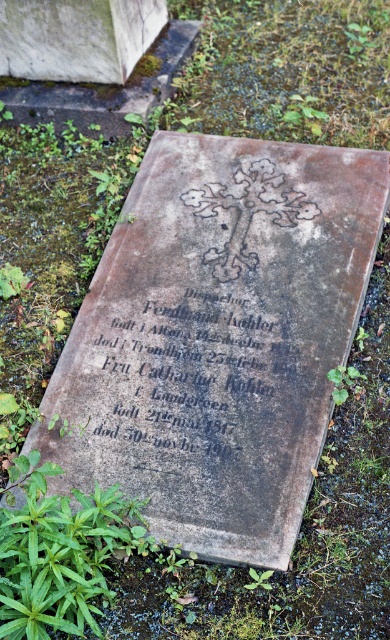
You are a historian examining the tombstone. You notice the black stone inscription at center and the green leafy plant at lower left. Which object is positioned higher on the tombstone?

The black stone inscription at center is above the green leafy plant at lower left, so the black stone inscription at center is positioned higher on the tombstone.

You are a gardener looking at the tombstone and the green leafy plant at lower left marked by point (60, 554). Which direction should you move to reach the plant from the tombstone?

The green leafy plant at lower left marked by point (60, 554) is located to the lower left of the tombstone. To reach it, move towards the lower left direction from the tombstone.